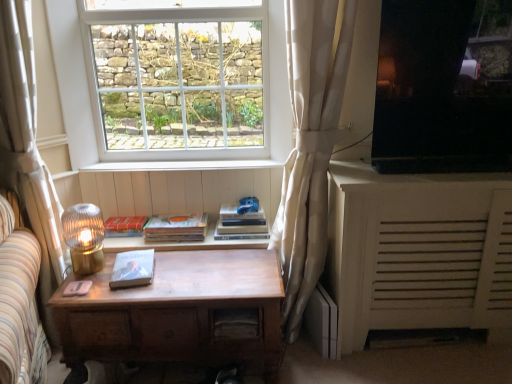
At what (x,y) coordinates should I click in order to perform the action: click on vacant point above hardcover book at center (from a real-world perspective). Please return your answer as a coordinate pair (x, y). The width and height of the screenshot is (512, 384). Looking at the image, I should click on (237, 209).